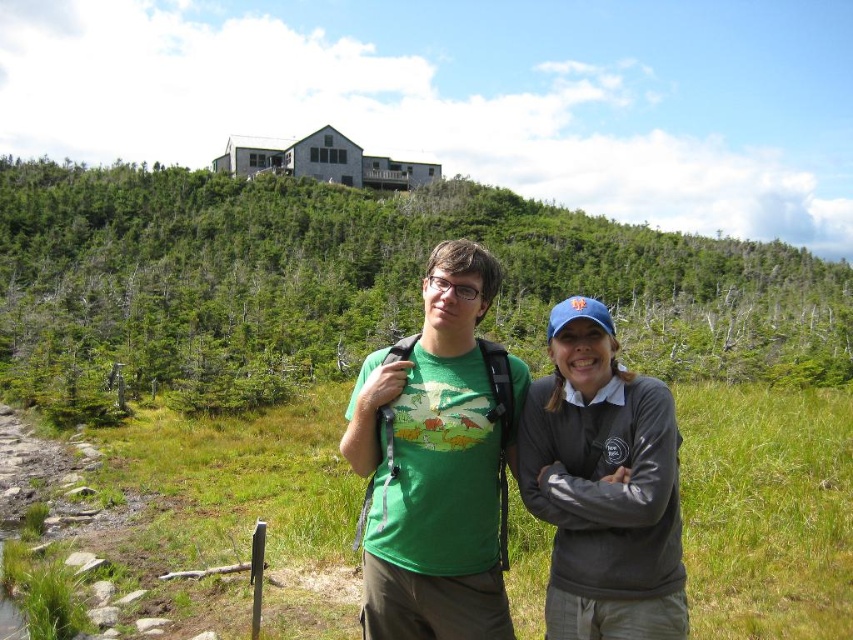
You are planning to take a photo of the two people in the scene. The photographer wants to ensure that both the green leafy hillside at upper center and the gray fleece jacket at center are clearly visible in the frame. Given their sizes, which object should be placed closer to the camera to maintain balance in the composition?

The gray fleece jacket at center should be placed closer to the camera because it is smaller in size compared to the green leafy hillside at upper center, which is larger. This adjustment would help balance the composition by making both elements appear more equal in the frame.